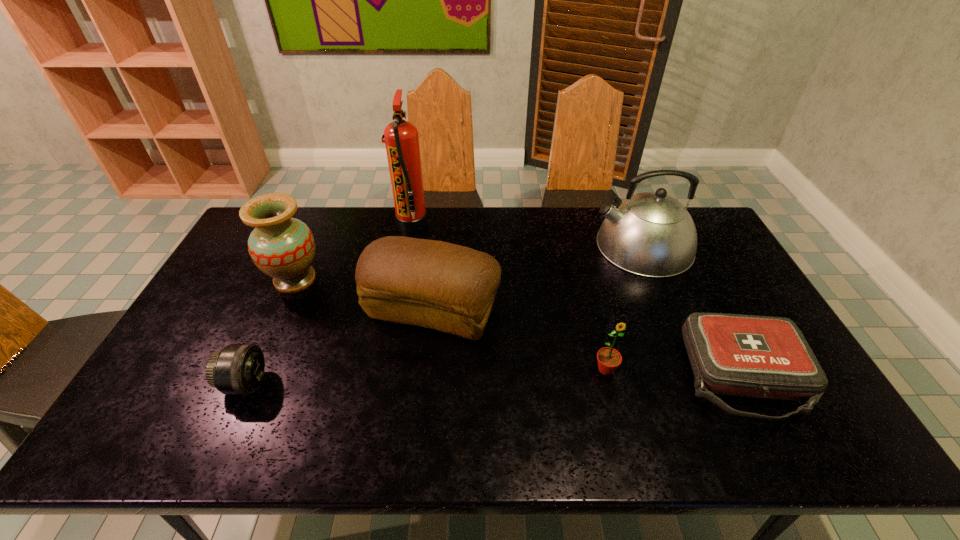
Image resolution: width=960 pixels, height=540 pixels. I want to click on free space that is in between the telephoto lens and the first-aid kit, so click(x=494, y=380).

This screenshot has height=540, width=960. Find the location of `vacant area that lies between the fire extinguisher and the sunflower`. vacant area that lies between the fire extinguisher and the sunflower is located at coordinates (509, 296).

Where is `free space between the telephoto lens and the sunflower`? free space between the telephoto lens and the sunflower is located at coordinates (425, 376).

I want to click on vacant region between the kettle and the bread, so click(538, 278).

Where is `free spot between the shortest object and the third shortest object`? This screenshot has height=540, width=960. free spot between the shortest object and the third shortest object is located at coordinates (674, 373).

Where is `object identified as the fifth closest to the third shortest object`? Image resolution: width=960 pixels, height=540 pixels. object identified as the fifth closest to the third shortest object is located at coordinates (282, 247).

Locate an element on the screen. The image size is (960, 540). the second closest object relative to the fourth shortest object is located at coordinates (238, 369).

The height and width of the screenshot is (540, 960). Identify the location of free space that satisfies the following two spatial constraints: 1. on the face of the fifth tallest object; 2. on the front-facing side of the telephoto lens. (609, 383).

This screenshot has height=540, width=960. What are the coordinates of `free location that satisfies the following two spatial constraints: 1. on the front side of the fourth tallest object; 2. on the left side of the first-aid kit` in the screenshot? It's located at (425, 376).

You are a GUI agent. You are given a task and a screenshot of the screen. Output one action in this format:
    pyautogui.click(x=<x>, y=<y>)
    Task: Click on the blank area in the image that satisfies the following two spatial constraints: 1. on the face of the third shortest object; 2. on the left side of the first-aid kit
    The height and width of the screenshot is (540, 960).
    Given the screenshot: What is the action you would take?
    pyautogui.click(x=608, y=376)